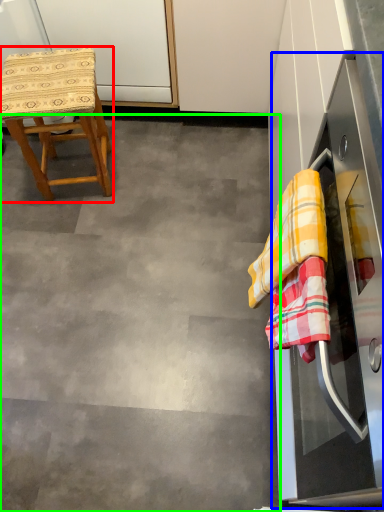
Question: Which is nearer to the stool (highlighted by a red box)? oven (highlighted by a blue box) or concrete (highlighted by a green box).

Choices:
 (A) oven
 (B) concrete

Answer: (B)